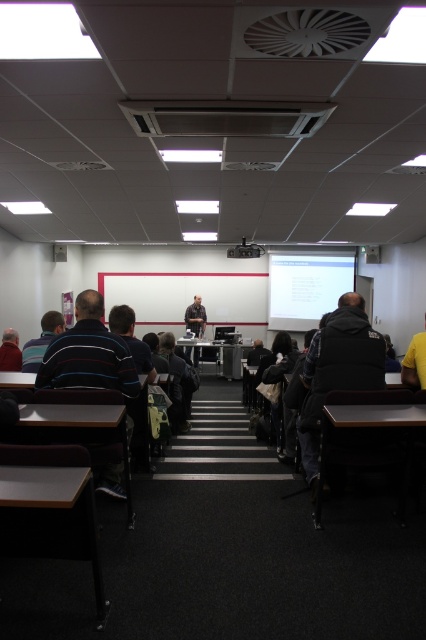
From the picture: Is metallic silver table at center taller than dark blue shirt at lower left?

Yes.

Based on the photo, can you confirm if metallic silver table at center is thinner than dark blue shirt at lower left?

Incorrect, metallic silver table at center's width is not less than dark blue shirt at lower left's.

Does point (232, 353) lie in front of point (20, 353)?

No, (232, 353) is further to viewer.

This screenshot has height=640, width=426. Identify the location of metallic silver table at center. (222, 356).

Can you confirm if white matte table at lower left is shorter than striped fabric shirt at left?

Correct, white matte table at lower left is not as tall as striped fabric shirt at left.

Locate an element on the screen. white matte table at lower left is located at coordinates (51, 518).

Looking at this image, who is positioned more to the right, white glossy projector screen at upper right or striped shirt at lower left?

white glossy projector screen at upper right

Is white glossy projector screen at upper right wider than striped shirt at lower left?

Yes.

At what (x,y) coordinates should I click in order to perform the action: click on white glossy projector screen at upper right. Please return your answer as a coordinate pair (x, y). Looking at the image, I should click on (305, 288).